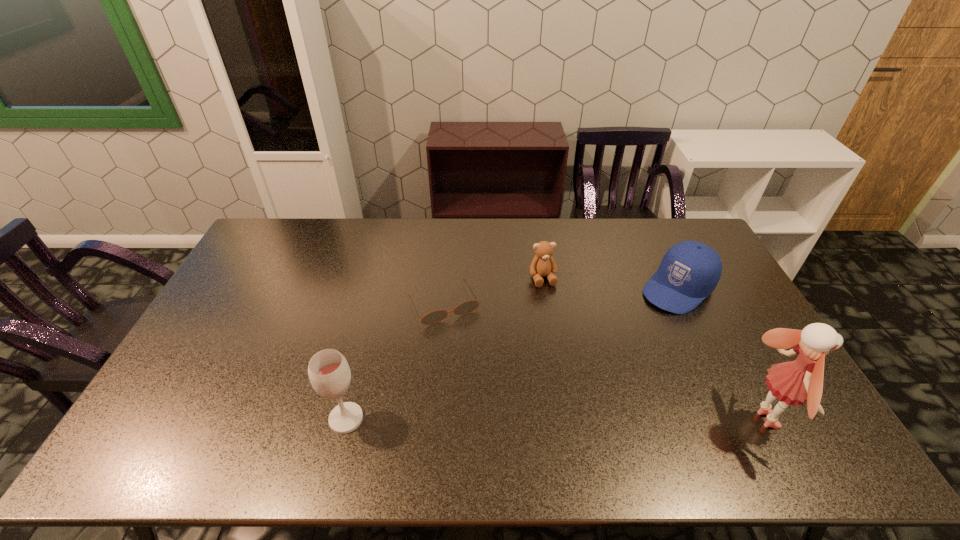
Identify the location of the fourth shortest object. tap(329, 373).

Locate an element on the screen. wineglass is located at coordinates (329, 373).

The height and width of the screenshot is (540, 960). What are the coordinates of `the tallest object` in the screenshot? It's located at click(x=795, y=382).

Locate an element on the screen. The image size is (960, 540). the shortest object is located at coordinates (437, 316).

Image resolution: width=960 pixels, height=540 pixels. Identify the location of the second object from left to right. (437, 316).

Locate an element on the screen. This screenshot has width=960, height=540. cap is located at coordinates pos(689,272).

Identify the location of teddy bear. pos(543,264).

You are a GUI agent. You are given a task and a screenshot of the screen. Output one action in this format:
    pyautogui.click(x=<x>, y=<y>)
    Task: Click on the free space located 0.070m on the right of the fourth shortest object
    
    Given the screenshot: What is the action you would take?
    pyautogui.click(x=391, y=418)

The height and width of the screenshot is (540, 960). In order to click on vacant space situated on the front-facing side of the tallest object in this screenshot , I will do `click(805, 420)`.

At what (x,y) coordinates should I click in order to perform the action: click on blank area located on the face of the shortest object. Please return your answer as a coordinate pair (x, y). The height and width of the screenshot is (540, 960). Looking at the image, I should click on (468, 350).